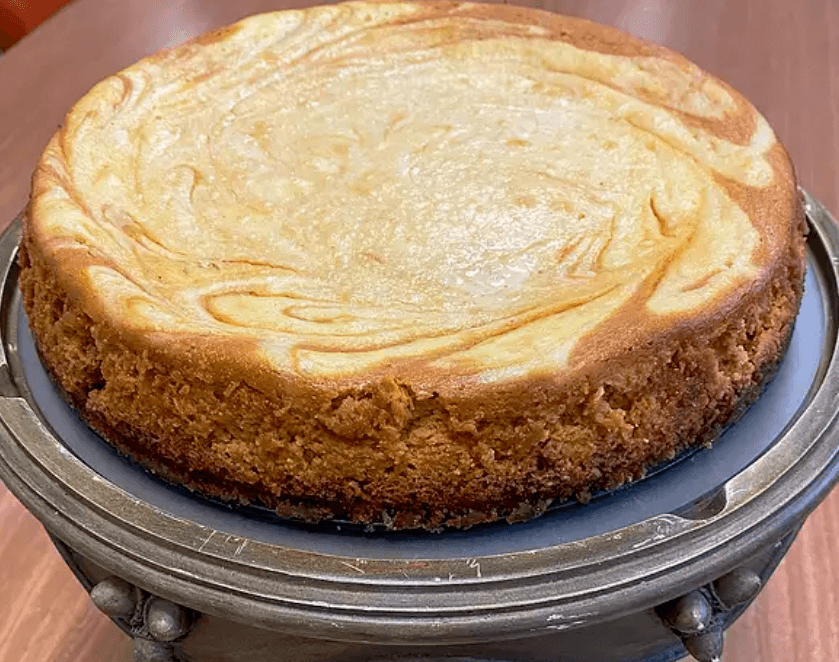
Where is `brown talbe`? brown talbe is located at coordinates (756, 20).